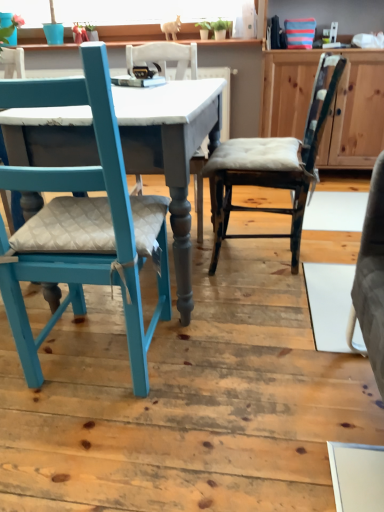
What do you see at coordinates (168, 132) in the screenshot? This screenshot has height=512, width=384. I see `matte gray table at center` at bounding box center [168, 132].

Identify the location of distressed wood chair at center, positioned as the second chair in left-to-right order. (273, 165).

The height and width of the screenshot is (512, 384). What are the coordinates of `teal painted wood chair at left, acting as the 1th chair starting from the left` in the screenshot? It's located at (85, 230).

Locate an element on the screen. The width and height of the screenshot is (384, 512). matte gray table at center is located at coordinates (168, 132).

Can you confirm if wooden cabinet at center is positioned to the right of matte gray table at center?

Yes.

In terms of width, does wooden cabinet at center look wider or thinner when compared to matte gray table at center?

In the image, wooden cabinet at center appears to be more narrow than matte gray table at center.

From the image's perspective, which one is positioned lower, wooden cabinet at center or matte gray table at center?

matte gray table at center, from the image's perspective.

Looking at this image, from a real-world perspective, is wooden cabinet at center above or below matte gray table at center?

From a real-world perspective, wooden cabinet at center is physically above matte gray table at center.

In the scene shown: Is matte gray table at center facing away from wooden cabinet at center?

That's not correct — matte gray table at center is not looking away from wooden cabinet at center.

Which object is further away from the camera, matte gray table at center or wooden cabinet at center?

Positioned behind is wooden cabinet at center.

From the image's perspective, does matte gray table at center appear lower than wooden cabinet at center?

Yes, from the image's perspective, matte gray table at center is below wooden cabinet at center.

Based on the photo, do you think distressed wood chair at center, which appears as the first chair when viewed from the right, is within matte gray table at center, or outside of it?

distressed wood chair at center, which appears as the first chair when viewed from the right, is spatially situated outside matte gray table at center.

How many degrees apart are the facing directions of distressed wood chair at center, positioned as the second chair in left-to-right order, and matte gray table at center?

distressed wood chair at center, positioned as the second chair in left-to-right order, and matte gray table at center are facing 89 degrees away from each other.

Considering the positions of objects distressed wood chair at center, which appears as the first chair when viewed from the right, and matte gray table at center in the image provided, who is behind, distressed wood chair at center, which appears as the first chair when viewed from the right, or matte gray table at center?

distressed wood chair at center, which appears as the first chair when viewed from the right, is more distant.

Considering the points (278, 167) and (27, 114), which point is behind, point (278, 167) or point (27, 114)?

Positioned behind is point (278, 167).

Is matte gray table at center not within teal painted wood chair at left, marked as the 2th chair in a right-to-left arrangement?

Yes, matte gray table at center is not within teal painted wood chair at left, marked as the 2th chair in a right-to-left arrangement.

Can you confirm if matte gray table at center is positioned to the right of teal painted wood chair at left, marked as the 2th chair in a right-to-left arrangement?

Indeed, matte gray table at center is positioned on the right side of teal painted wood chair at left, marked as the 2th chair in a right-to-left arrangement.

From the image's perspective, is matte gray table at center beneath teal painted wood chair at left, acting as the 1th chair starting from the left?

No.

From a real-world perspective, is matte gray table at center located higher than teal painted wood chair at left, acting as the 1th chair starting from the left?

No, from a real-world perspective, matte gray table at center is not over teal painted wood chair at left, acting as the 1th chair starting from the left

In the scene shown: Based on their sizes in the image, would you say teal painted wood chair at left, acting as the 1th chair starting from the left, is bigger or smaller than distressed wood chair at center, which appears as the first chair when viewed from the right?

Considering their sizes, teal painted wood chair at left, acting as the 1th chair starting from the left, takes up more space than distressed wood chair at center, which appears as the first chair when viewed from the right.

Who is shorter, teal painted wood chair at left, marked as the 2th chair in a right-to-left arrangement, or distressed wood chair at center, which appears as the first chair when viewed from the right?

Standing shorter between the two is distressed wood chair at center, which appears as the first chair when viewed from the right.

Is distressed wood chair at center, positioned as the second chair in left-to-right order, located within teal painted wood chair at left, marked as the 2th chair in a right-to-left arrangement?

Definitely not — distressed wood chair at center, positioned as the second chair in left-to-right order, is not inside teal painted wood chair at left, marked as the 2th chair in a right-to-left arrangement.

Considering their positions, is teal painted wood chair at left, acting as the 1th chair starting from the left, located in front of or behind distressed wood chair at center, positioned as the second chair in left-to-right order?

Visually, teal painted wood chair at left, acting as the 1th chair starting from the left, is located in front of distressed wood chair at center, positioned as the second chair in left-to-right order.

Which is more to the right, distressed wood chair at center, positioned as the second chair in left-to-right order, or wooden cabinet at center?

Positioned to the right is wooden cabinet at center.

Is distressed wood chair at center, which appears as the first chair when viewed from the right, oriented towards wooden cabinet at center?

No, distressed wood chair at center, which appears as the first chair when viewed from the right, is not aimed at wooden cabinet at center.

Consider the image. From a real-world perspective, between distressed wood chair at center, positioned as the second chair in left-to-right order, and wooden cabinet at center, who is vertically higher?

From a 3D spatial view, wooden cabinet at center is above.

Looking at this image, can you confirm if distressed wood chair at center, positioned as the second chair in left-to-right order, is bigger than wooden cabinet at center?

No.

Is matte gray table at center outside of distressed wood chair at center, which appears as the first chair when viewed from the right?

Indeed, matte gray table at center is completely outside distressed wood chair at center, which appears as the first chair when viewed from the right.

Which of these two, matte gray table at center or distressed wood chair at center, which appears as the first chair when viewed from the right, is smaller?

With smaller size is distressed wood chair at center, which appears as the first chair when viewed from the right.

Is point (196, 144) farther from viewer compared to point (266, 148)?

No, (196, 144) is closer to viewer.

Does matte gray table at center appear on the right side of distressed wood chair at center, positioned as the second chair in left-to-right order?

No.

You are a GUI agent. You are given a task and a screenshot of the screen. Output one action in this format:
    pyautogui.click(x=<x>, y=<y>)
    Task: Click on the cabinetry on the right of matte gray table at center
    The image size is (384, 512).
    Given the screenshot: What is the action you would take?
    pyautogui.click(x=356, y=113)

In order to click on table in front of the wooden cabinet at center in this screenshot , I will do `click(168, 132)`.

Estimate the real-world distances between objects in this image. Which object is further from wooden cabinet at center, distressed wood chair at center, which appears as the first chair when viewed from the right, or teal painted wood chair at left, marked as the 2th chair in a right-to-left arrangement?

Among the two, teal painted wood chair at left, marked as the 2th chair in a right-to-left arrangement, is located further to wooden cabinet at center.

Looking at the image, which one is located closer to wooden cabinet at center, teal painted wood chair at left, marked as the 2th chair in a right-to-left arrangement, or matte gray table at center?

Among the two, matte gray table at center is located nearer to wooden cabinet at center.

Considering their positions, is distressed wood chair at center, which appears as the first chair when viewed from the right, positioned closer to wooden cabinet at center than matte gray table at center?

distressed wood chair at center, which appears as the first chair when viewed from the right, is positioned closer to the anchor wooden cabinet at center.

Estimate the real-world distances between objects in this image. Which object is further from wooden cabinet at center, matte gray table at center or distressed wood chair at center, positioned as the second chair in left-to-right order?

The object further to wooden cabinet at center is matte gray table at center.

Looking at the image, which one is located closer to matte gray table at center, distressed wood chair at center, positioned as the second chair in left-to-right order, or wooden cabinet at center?

Among the two, distressed wood chair at center, positioned as the second chair in left-to-right order, is located nearer to matte gray table at center.

Which object lies nearer to the anchor point matte gray table at center, distressed wood chair at center, which appears as the first chair when viewed from the right, or teal painted wood chair at left, marked as the 2th chair in a right-to-left arrangement?

Among the two, teal painted wood chair at left, marked as the 2th chair in a right-to-left arrangement, is located nearer to matte gray table at center.

Looking at the image, which one is located closer to distressed wood chair at center, positioned as the second chair in left-to-right order, wooden cabinet at center or matte gray table at center?

matte gray table at center is positioned closer to the anchor distressed wood chair at center, positioned as the second chair in left-to-right order.

When comparing their distances from teal painted wood chair at left, acting as the 1th chair starting from the left, does matte gray table at center or distressed wood chair at center, positioned as the second chair in left-to-right order, seem closer?

matte gray table at center lies closer to teal painted wood chair at left, acting as the 1th chair starting from the left, than the other object.

At what (x,y) coordinates should I click in order to perform the action: click on table between teal painted wood chair at left, marked as the 2th chair in a right-to-left arrangement, and distressed wood chair at center, positioned as the second chair in left-to-right order. Please return your answer as a coordinate pair (x, y). Looking at the image, I should click on (168, 132).

Image resolution: width=384 pixels, height=512 pixels. I want to click on chair located between matte gray table at center and wooden cabinet at center in the depth direction, so click(273, 165).

You are a GUI agent. You are given a task and a screenshot of the screen. Output one action in this format:
    pyautogui.click(x=<x>, y=<y>)
    Task: Click on the table between teal painted wood chair at left, acting as the 1th chair starting from the left, and wooden cabinet at center in the front-back direction
    This screenshot has width=384, height=512.
    Given the screenshot: What is the action you would take?
    pyautogui.click(x=168, y=132)

Where is `chair between teal painted wood chair at left, marked as the 2th chair in a right-to-left arrangement, and wooden cabinet at center from front to back`? The height and width of the screenshot is (512, 384). chair between teal painted wood chair at left, marked as the 2th chair in a right-to-left arrangement, and wooden cabinet at center from front to back is located at coordinates (273, 165).